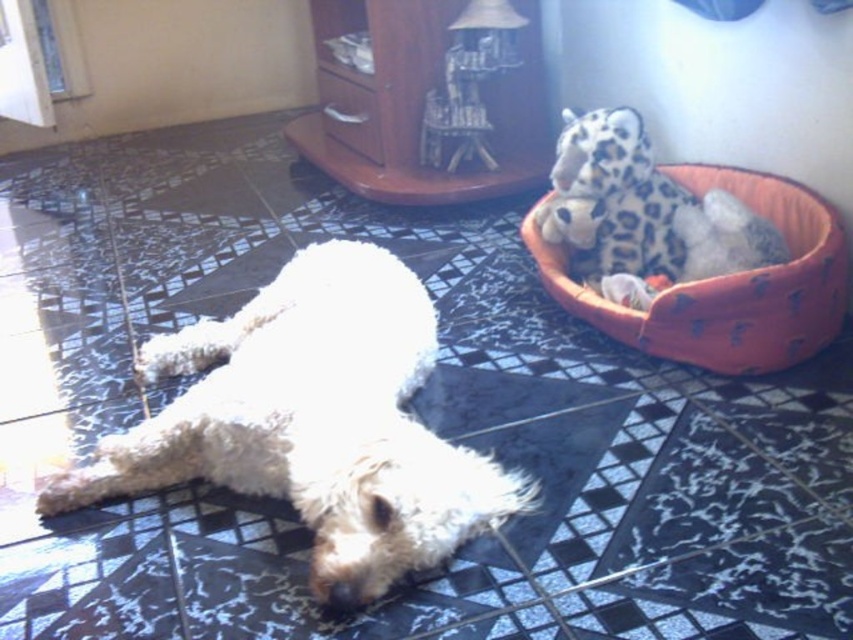
You are a pet owner who wants to place a new toy for your dog. The toy must be placed in a spot that is above the white fluffy dog at center but still within the orange fabric dog bed at upper right. Is this possible?

The white fluffy dog at center is located below the orange fabric dog bed at upper right, so yes, placing the toy above the dog but within the bed is possible since the bed is positioned higher up.

Please provide the coordinates of the white fluffy dog at center in the image. The coordinate system is normalized, meaning the origin is at the bottom left corner of the image, and the maximum coordinate is at the top right corner. The coordinates are represented as a tuple of two values between 0 and 1, where the first value is the x coordinate and the second is the y coordinate. The x axis increases to the right, and the y axis increases upwards. Please provide your answer in the format of a tuple with 4

The coordinates of the white fluffy dog at center are at point (315, 422).

Based on the photo, you are a pet sitter who needs to place a new toy for the white fluffy dog at center. The toy must be placed within 20 inches of the dog to ensure it can reach it. Is the orange fabric dog bed at upper right within this 20 inch reach? Please explain your reasoning.

The white fluffy dog at center is 25.32 inches away from the orange fabric dog bed at upper right. Since 25.32 inches is greater than 20 inches, the orange fabric dog bed at upper right is outside the dog s 20 inch reach. Therefore, placing the new toy there would be too far for the dog to reach.